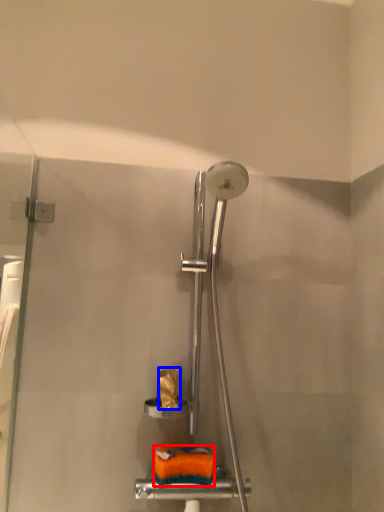
Question: Which object appears farthest to the camera in this image, material (highlighted by a red box) or toilet paper (highlighted by a blue box)?

Choices:
 (A) material
 (B) toilet paper

Answer: (B)